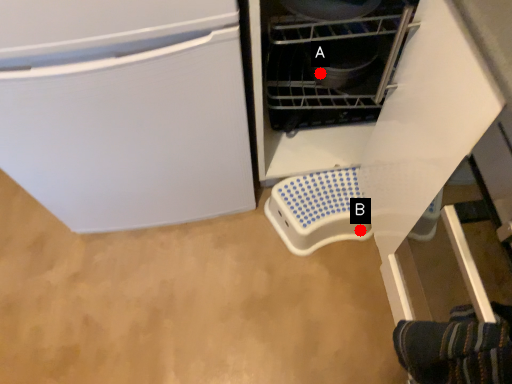
Question: Two points are circled on the image, labeled by A and B beside each circle. Which point is farther from the camera taking this photo?

Choices:
 (A) A is further
 (B) B is further

Answer: (B)